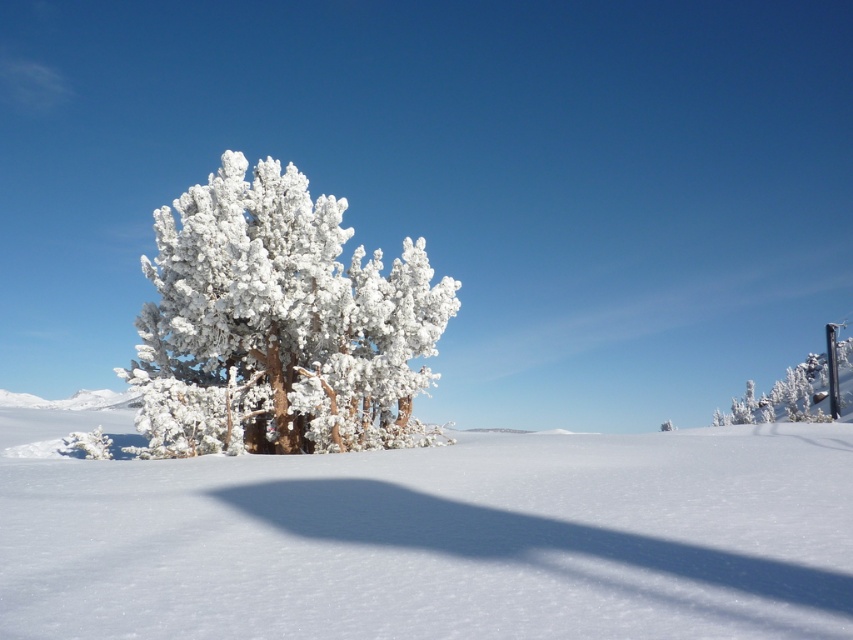
You are a photographer planning to capture a winter scene with the frosted white tree at center and the white frosty tree at upper right. Which tree should you focus on if you want to highlight the one that appears wider in the photo?

The white frosty tree at upper right should be focused on because it has a greater width than the frosted white tree at center.

You are an observer standing in the winter landscape. You notice the frosted white tree at center and the white frosty tree at upper right. Which tree is positioned higher in the image?

The frosted white tree at center is positioned higher in the image than the white frosty tree at upper right.

You are an artist planning to paint this winter scene. You want to ensure the white frosty tree at center and the white frosty tree at upper right are proportionally accurate. Which tree should you draw wider in your painting?

The white frosty tree at center should be drawn wider because its width is larger than the white frosty tree at upper right.